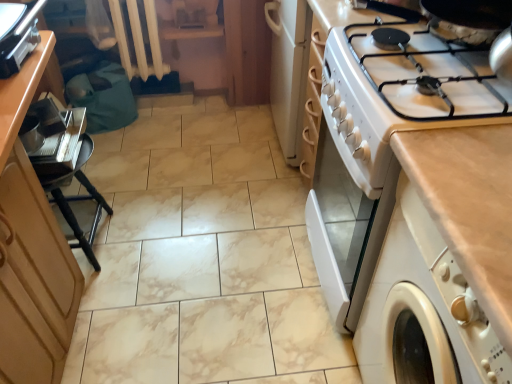
Question: Is wooden cabinet at left taller or shorter than metallic silver tray at left?

Choices:
 (A) short
 (B) tall

Answer: (B)

Question: From the image's perspective, is wooden cabinet at left located above or below metallic silver tray at left?

Choices:
 (A) below
 (B) above

Answer: (A)

Question: Which of these objects is positioned closest to the metallic silver tray at left?

Choices:
 (A) metallic silver toaster at upper left
 (B) beige laminate countertop at right
 (C) wooden cabinet at left
 (D) wooden radiator at upper left
 (E) white glossy gas stove at upper right

Answer: (A)

Question: Based on their relative distances, which object is farther from the wooden radiator at upper left?

Choices:
 (A) wooden cabinet at left
 (B) beige laminate countertop at right
 (C) white glossy gas stove at upper right
 (D) metallic silver tray at left
 (E) metallic silver toaster at upper left

Answer: (B)